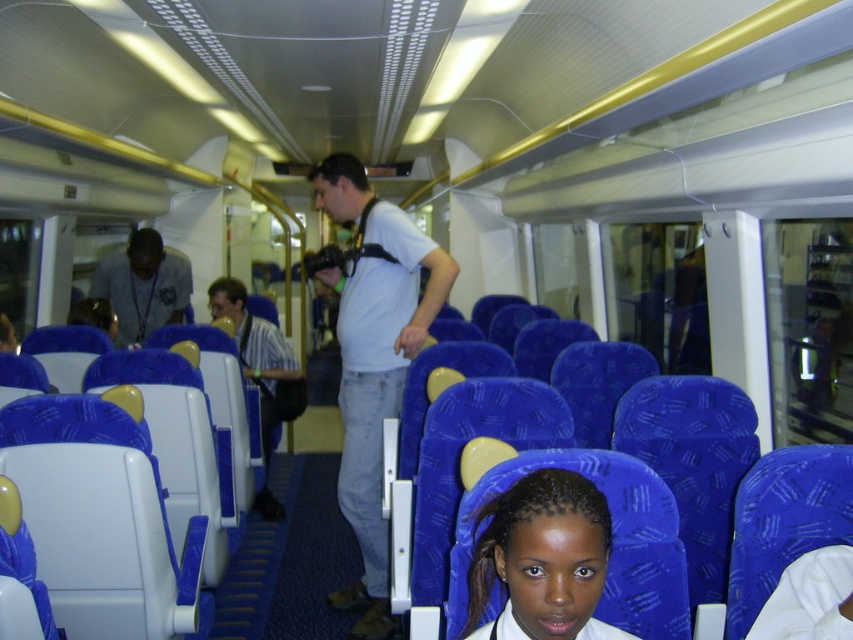
Question: Does smooth skin face at center have a lesser width compared to matte gray shirt at left?

Choices:
 (A) yes
 (B) no

Answer: (A)

Question: Observing the image, what is the correct spatial positioning of white matte shirt at center in reference to smooth skin face at center?

Choices:
 (A) below
 (B) above

Answer: (B)

Question: Which of the following is the farthest from the observer?

Choices:
 (A) (378, 461)
 (B) (264, 403)
 (C) (151, 330)

Answer: (C)

Question: Considering the relative positions of white matte shirt at center and striped shirt at center in the image provided, where is white matte shirt at center located with respect to striped shirt at center?

Choices:
 (A) below
 (B) above

Answer: (B)

Question: Among these objects, which one is nearest to the camera?

Choices:
 (A) striped shirt at center
 (B) white matte shirt at center
 (C) smooth skin face at center
 (D) matte gray shirt at left

Answer: (C)

Question: Which of the following is the closest to the observer?

Choices:
 (A) white matte shirt at center
 (B) striped shirt at center
 (C) smooth skin face at center

Answer: (C)